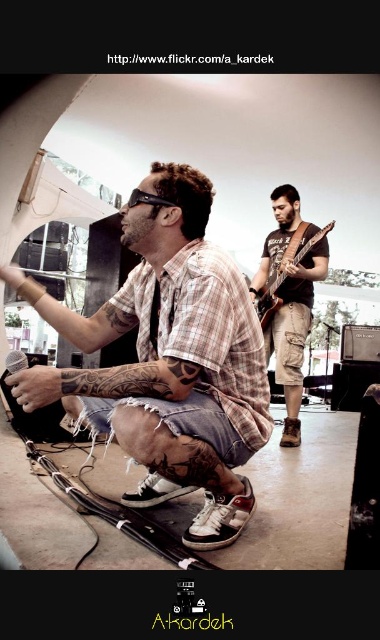
You are a photographer setting up for a live music performance. You see the brown leather guitar at center and the wooden electric guitar at center. Which guitar should you adjust your camera focus to first if you want to capture both in the frame without moving the camera?

The brown leather guitar at center might be wider than wooden electric guitar at center, so you should focus on the brown leather guitar at center first to ensure it fits within the frame.